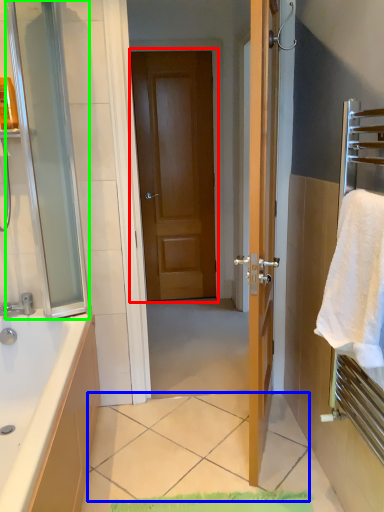
Question: Considering the real-world distances, which object is farthest from door (highlighted by a red box)? tile (highlighted by a blue box) or screen door (highlighted by a green box)?

Choices:
 (A) tile
 (B) screen door

Answer: (A)